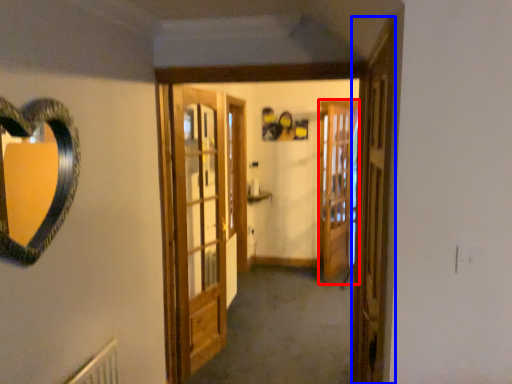
Question: Among these objects, which one is farthest to the camera, screen door (highlighted by a red box) or screen door (highlighted by a blue box)?

Choices:
 (A) screen door
 (B) screen door

Answer: (A)